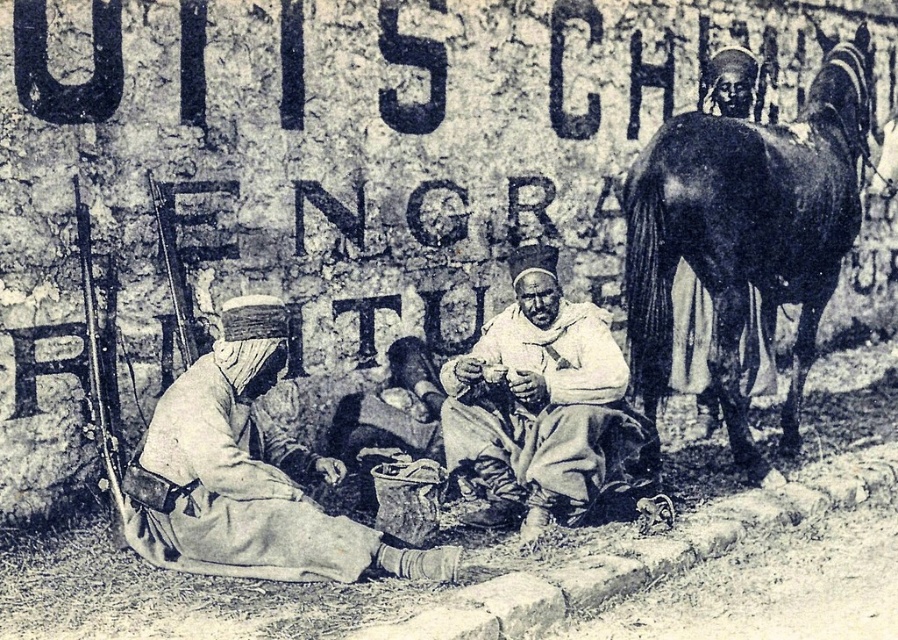
Between light beige fabric at center and white clothed man at center, which one is positioned lower?

light beige fabric at center

Which of these two, light beige fabric at center or white clothed man at center, stands shorter?

Standing shorter between the two is light beige fabric at center.

Is point (183, 394) farther from camera compared to point (483, 365)?

No, (183, 394) is closer to viewer.

Find the location of `light beige fabric at center`. light beige fabric at center is located at coordinates (247, 476).

Which is in front, point (689, 250) or point (191, 518)?

Point (191, 518) is more forward.

Does dark brown glossy horse at right appear on the right side of light beige fabric at center?

Correct, you'll find dark brown glossy horse at right to the right of light beige fabric at center.

Find the location of a particular element. The width and height of the screenshot is (898, 640). dark brown glossy horse at right is located at coordinates (747, 232).

Which is in front, point (659, 204) or point (613, 356)?

Point (659, 204) is in front.

Between dark brown glossy horse at right and white clothed man at center, which one is positioned higher?

dark brown glossy horse at right is above.

Does point (758, 250) lie in front of point (549, 378)?

That is False.

Find the location of a particular element. dark brown glossy horse at right is located at coordinates (747, 232).